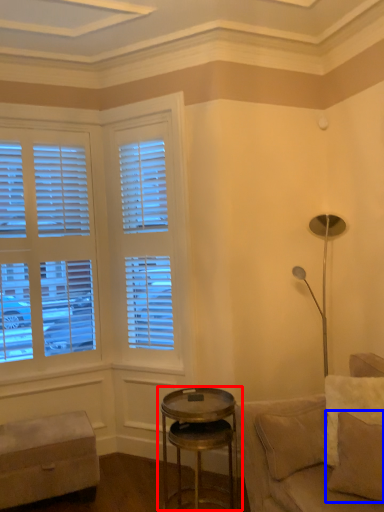
Question: Which object appears closest to the camera in this image, table (highlighted by a red box) or pillow (highlighted by a blue box)?

Choices:
 (A) table
 (B) pillow

Answer: (B)